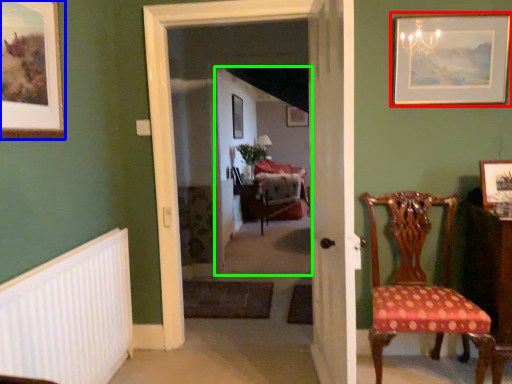
Question: Which is farther away from picture frame (highlighted by a red box)? picture frame (highlighted by a blue box) or corridor (highlighted by a green box)?

Choices:
 (A) picture frame
 (B) corridor

Answer: (B)